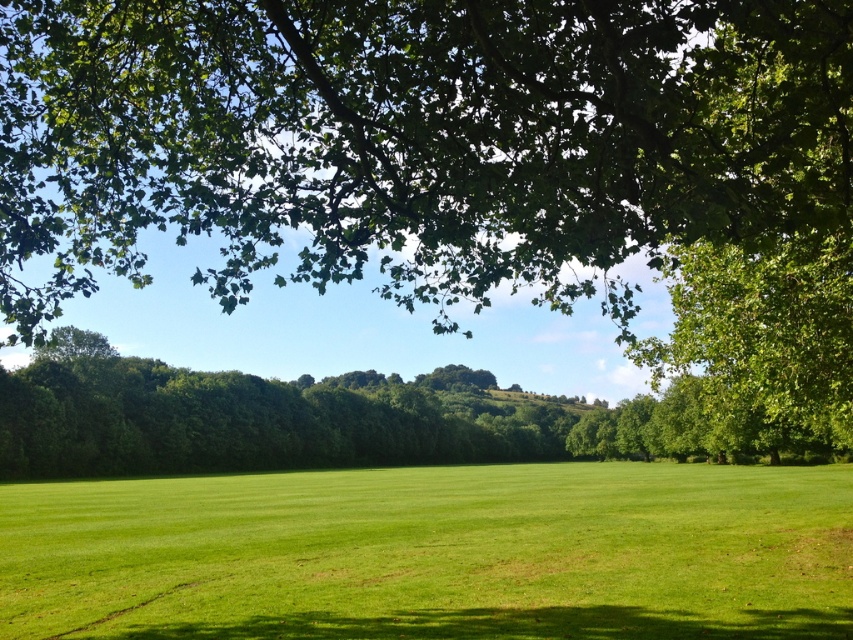
Question: Among these points, which one is farthest from the camera?

Choices:
 (A) (207, 628)
 (B) (328, 20)
 (C) (747, 269)

Answer: (C)

Question: Which object is positioned farthest from the green leafy tree at upper center?

Choices:
 (A) green grass at center
 (B) green leafy tree at upper right

Answer: (B)

Question: Which of the following is the closest to the observer?

Choices:
 (A) (729, 417)
 (B) (70, 140)
 (C) (384, 480)

Answer: (B)

Question: Can you confirm if green leafy tree at upper center is positioned to the right of green grass at center?

Choices:
 (A) no
 (B) yes

Answer: (A)

Question: Does green leafy tree at upper center have a greater width compared to green leafy tree at upper right?

Choices:
 (A) yes
 (B) no

Answer: (A)

Question: Does green leafy tree at upper center have a greater width compared to green leafy tree at upper right?

Choices:
 (A) yes
 (B) no

Answer: (A)